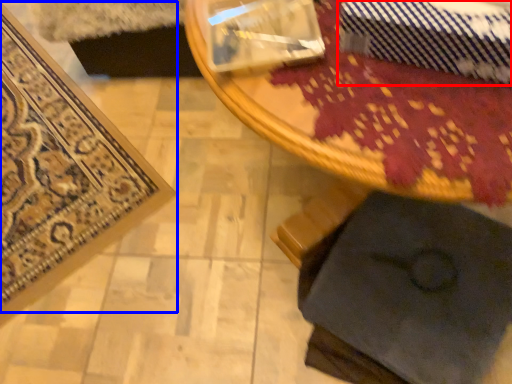
Question: Which object is further to the camera taking this photo, tie (highlighted by a red box) or mat (highlighted by a blue box)?

Choices:
 (A) tie
 (B) mat

Answer: (B)